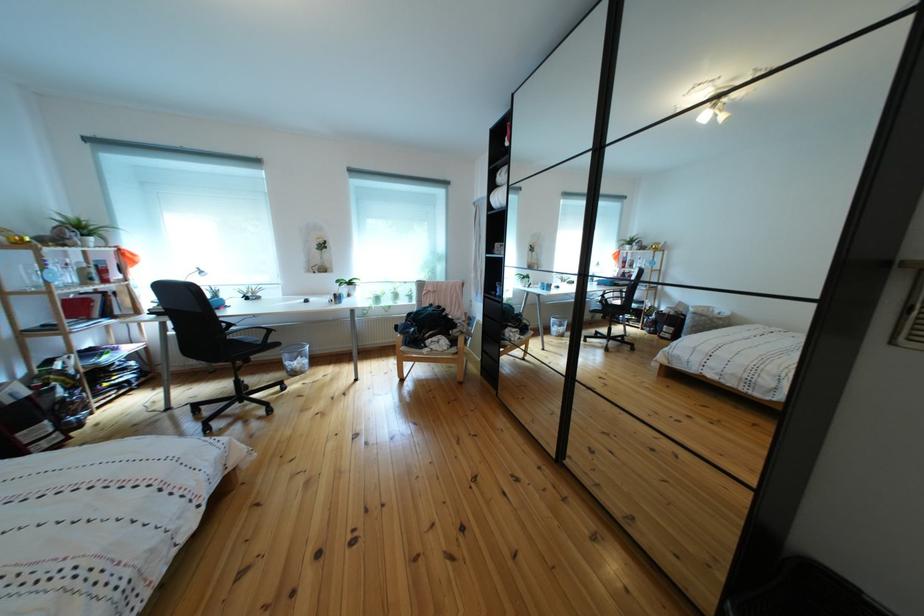
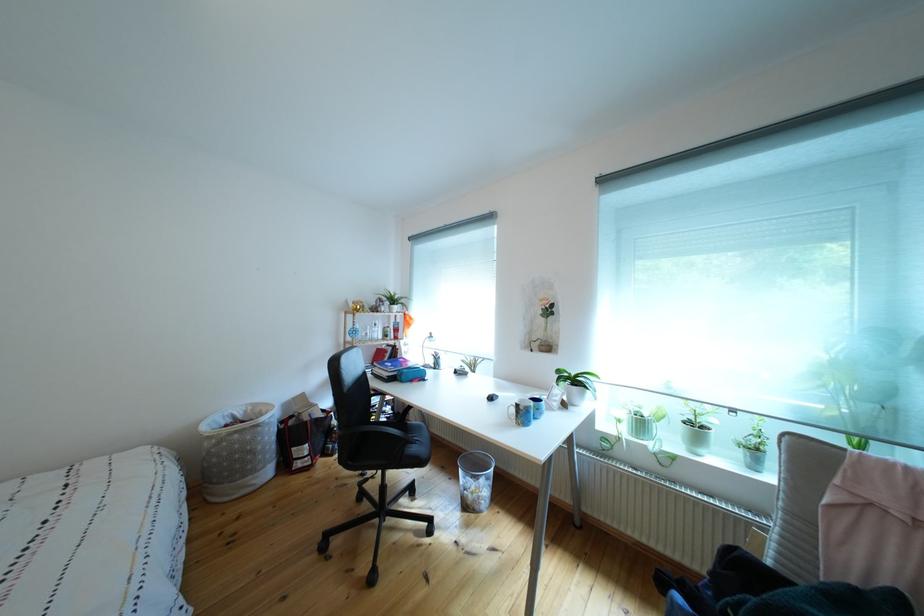
In the second image, find the point that corresponds to point 348,304 in the first image.

(533, 419)